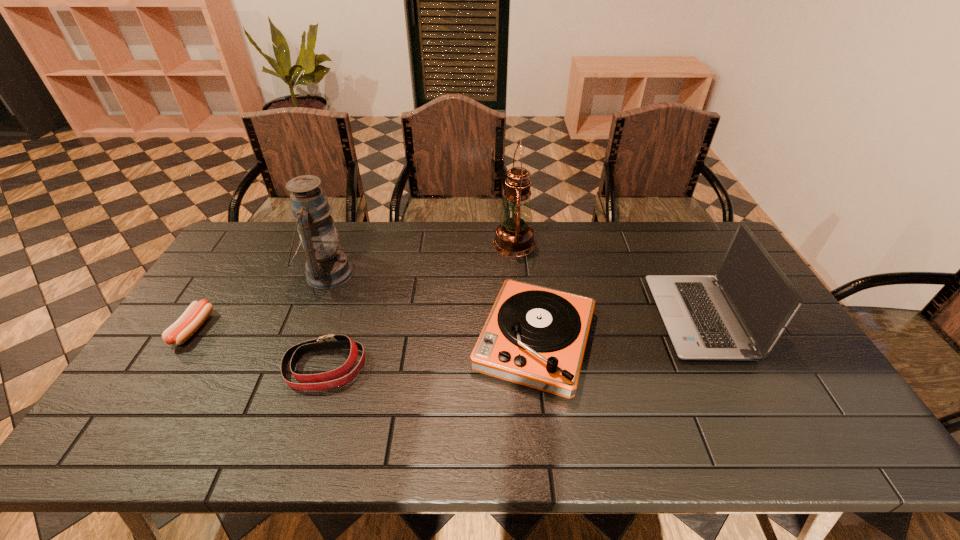
The height and width of the screenshot is (540, 960). In order to click on the right oil lamp in this screenshot , I will do `click(514, 237)`.

Where is `the left oil lamp`? This screenshot has width=960, height=540. the left oil lamp is located at coordinates point(326,267).

Where is `laptop computer`? laptop computer is located at coordinates coord(740,313).

Identify the location of the fourth shortest object. This screenshot has width=960, height=540. (740, 313).

This screenshot has height=540, width=960. In order to click on record player in this screenshot , I will do `click(535, 336)`.

In order to click on the fifth tallest object in this screenshot , I will do `click(327, 342)`.

At what (x,y) coordinates should I click in order to perform the action: click on sausage. Please return your answer as a coordinate pair (x, y). Looking at the image, I should click on click(195, 315).

Where is `the leftmost object`? This screenshot has height=540, width=960. the leftmost object is located at coordinates (195, 315).

I want to click on free space located on the front of the right oil lamp, so click(522, 329).

Where is `vacant space situated 0.240m on the left of the left oil lamp`? The image size is (960, 540). vacant space situated 0.240m on the left of the left oil lamp is located at coordinates (x=228, y=274).